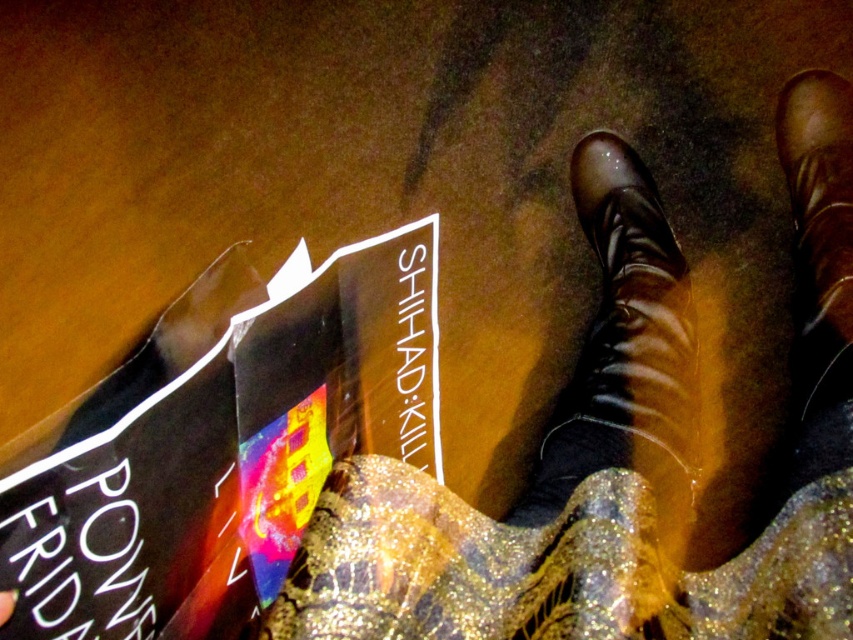
Is shiny leather boot at center positioned in front of brown leather boot at center?

Yes, it is in front of brown leather boot at center.

Between point (543, 493) and point (807, 211), which one is positioned in front?

Point (543, 493) is more forward.

The image size is (853, 640). What do you see at coordinates (625, 353) in the screenshot? I see `shiny leather boot at center` at bounding box center [625, 353].

The height and width of the screenshot is (640, 853). What are the coordinates of `shiny leather boot at center` in the screenshot? It's located at (625, 353).

Which of these two, black matte book at lower left or shiny leather boot at center, stands shorter?

Standing shorter between the two is black matte book at lower left.

Between point (314, 385) and point (654, 212), which one is positioned behind?

Point (654, 212)

At what (x,y) coordinates should I click in order to perform the action: click on black matte book at lower left. Please return your answer as a coordinate pair (x, y). The image size is (853, 640). Looking at the image, I should click on (228, 456).

Between black matte book at lower left and brown leather boot at center, which one has more height?

With more height is brown leather boot at center.

Is point (155, 480) positioned in front of point (822, 353)?

Yes, it is in front of point (822, 353).

Does point (373, 380) lie behind point (846, 124)?

No, it is in front of (846, 124).

You are a GUI agent. You are given a task and a screenshot of the screen. Output one action in this format:
    pyautogui.click(x=<x>, y=<y>)
    Task: Click on the black matte book at lower left
    The image size is (853, 640).
    Given the screenshot: What is the action you would take?
    pyautogui.click(x=228, y=456)